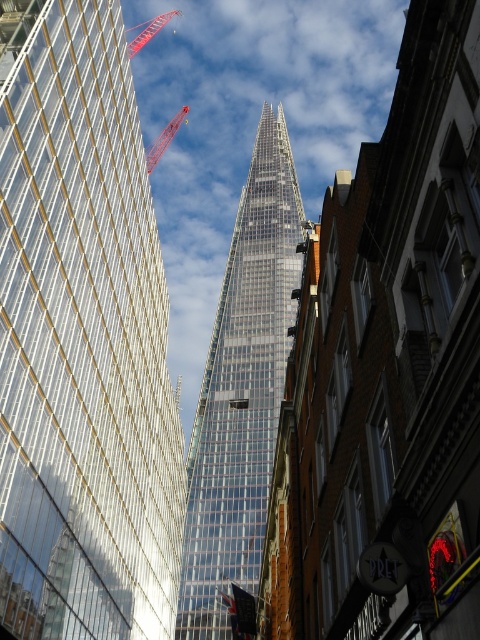
Question: Which of the following is the closest to the observer?

Choices:
 (A) (184, 106)
 (B) (268, 288)
 (C) (64, 109)
 (D) (132, 28)

Answer: (C)

Question: From the image, what is the correct spatial relationship of transparent glass skyscraper at center in relation to transparent glass tower at center?

Choices:
 (A) above
 (B) below

Answer: (B)

Question: Among these objects, which one is nearest to the camera?

Choices:
 (A) red metal crane at upper left
 (B) metallic red crane at upper center

Answer: (B)

Question: Observing the image, what is the correct spatial positioning of transparent glass skyscraper at center in reference to metallic red crane at upper center?

Choices:
 (A) below
 (B) above

Answer: (A)

Question: Does transparent glass skyscraper at center have a greater width compared to red metal crane at upper left?

Choices:
 (A) no
 (B) yes

Answer: (A)

Question: Which point is farther to the camera?

Choices:
 (A) (268, 474)
 (B) (113, 628)
 (C) (158, 20)

Answer: (C)